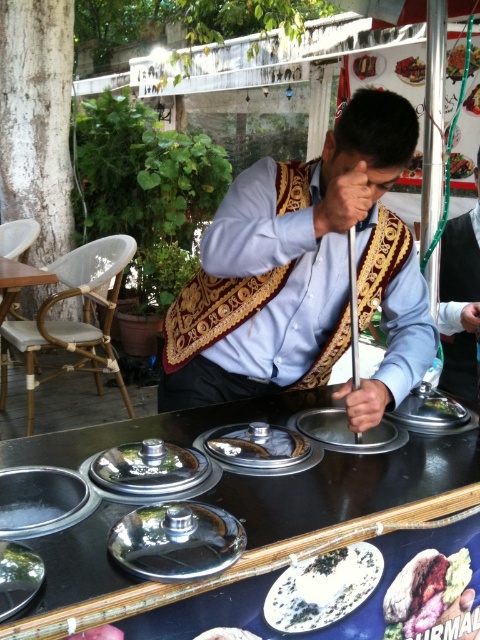
Who is shorter, shiny metallic lid at center or white fluffy bread at center?

Standing shorter between the two is white fluffy bread at center.

Does point (236, 538) lie behind point (210, 636)?

That is False.

Identify the location of shiny metallic lid at center. The height and width of the screenshot is (640, 480). (177, 541).

How far apart are white glossy plate at center and green leafy vegetable at center?

white glossy plate at center is 3.78 meters away from green leafy vegetable at center.

Between white glossy plate at center and green leafy vegetable at center, which one is positioned lower?

white glossy plate at center

Identify the location of white glossy plate at center. The width and height of the screenshot is (480, 640). (323, 588).

Who is lower down, shiny brown bread at center or smooth white rice at center?

shiny brown bread at center is lower down.

Is shiny brown bread at center positioned at the back of smooth white rice at center?

No.

Does point (475, 634) come behind point (472, 106)?

No, (475, 634) is in front of (472, 106).

Locate an element on the screen. shiny brown bread at center is located at coordinates (432, 598).